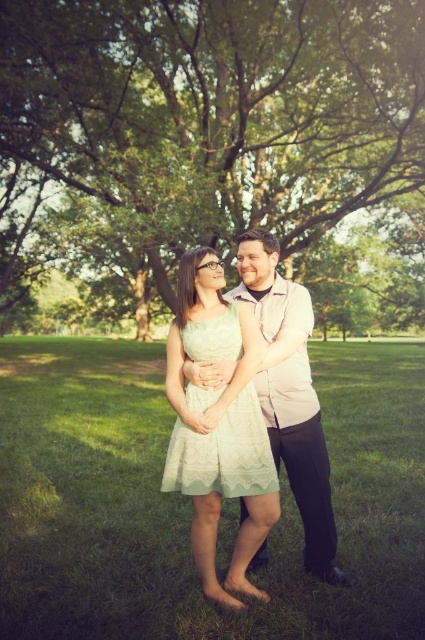
Does green leafy tree at center appear on the left side of lace fabric dress at center?

Yes, green leafy tree at center is to the left of lace fabric dress at center.

Who is higher up, green leafy tree at center or lace fabric dress at center?

green leafy tree at center

What do you see at coordinates (218, 109) in the screenshot? The height and width of the screenshot is (640, 425). I see `green leafy tree at center` at bounding box center [218, 109].

The height and width of the screenshot is (640, 425). I want to click on green leafy tree at center, so click(x=218, y=109).

Does green grass at center appear on the right side of lace fabric dress at center?

Correct, you'll find green grass at center to the right of lace fabric dress at center.

Is point (132, 428) positioned after point (215, 353)?

Yes, it is.

You are a GUI agent. You are given a task and a screenshot of the screen. Output one action in this format:
    pyautogui.click(x=<x>, y=<y>)
    Task: Click on the green grass at center
    The height and width of the screenshot is (640, 425).
    Given the screenshot: What is the action you would take?
    pyautogui.click(x=189, y=502)

Is light green lace dress at center shorter than lace fabric dress at center?

No, light green lace dress at center is not shorter than lace fabric dress at center.

This screenshot has width=425, height=640. I want to click on light green lace dress at center, so click(291, 396).